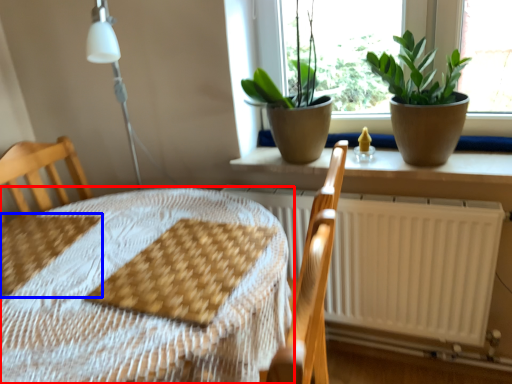
Question: Which object is closer to the camera taking this photo, table (highlighted by a red box) or sheet (highlighted by a blue box)?

Choices:
 (A) table
 (B) sheet

Answer: (A)